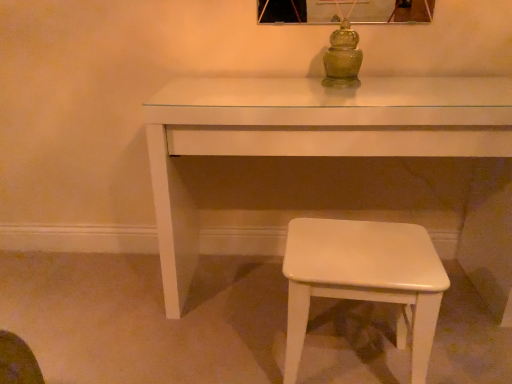
This screenshot has height=384, width=512. I want to click on free space underneath green glass jar at center (from a real-world perspective), so click(x=336, y=85).